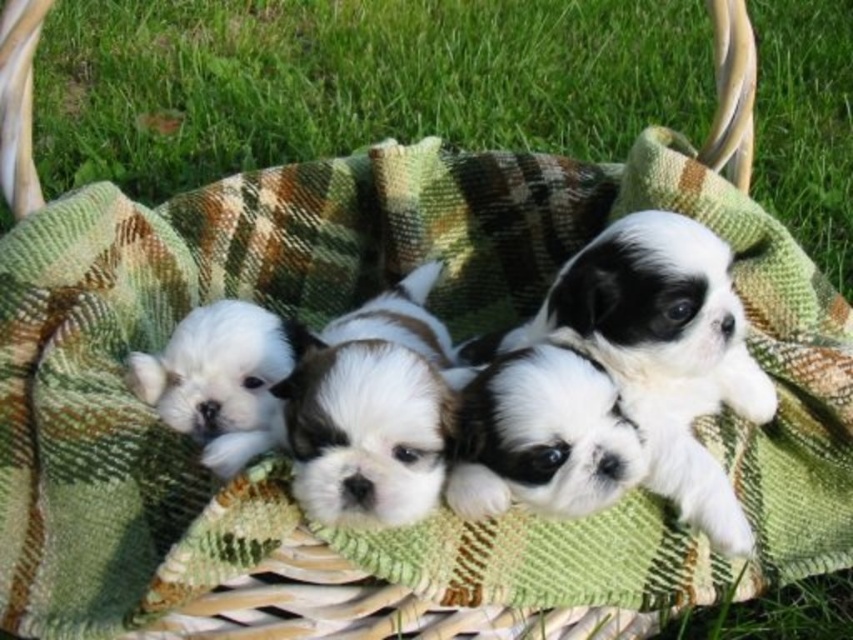
You are a photographer wanting to capture the white fluffy dog at center without the green grass at lower center appearing in the background. Is the current arrangement suitable for this?

The white fluffy dog at center is in front of the green grass at lower center, so the grass will be visible in the background. To avoid it, adjust the dog or change the background.

You are a photographer setting up a shoot with these puppies. You want to position a small stool so that it is exactly between the white fluffy dog at center and the white fluffy puppy at left. If the stool is 10 cm tall, will its height interfere with the taller puppy?

The white fluffy puppy at left is taller than the white fluffy dog at center. Since the stool is only 10 cm tall, it won

You are a photographer trying to capture a closeup of the white fluffy dog at center. You want to focus on the exact point at coordinates (543, 436). Is this point located on the white fluffy dog at center?

Yes, the point at coordinates (543, 436) is located on the white fluffy dog at center according to the provided information.